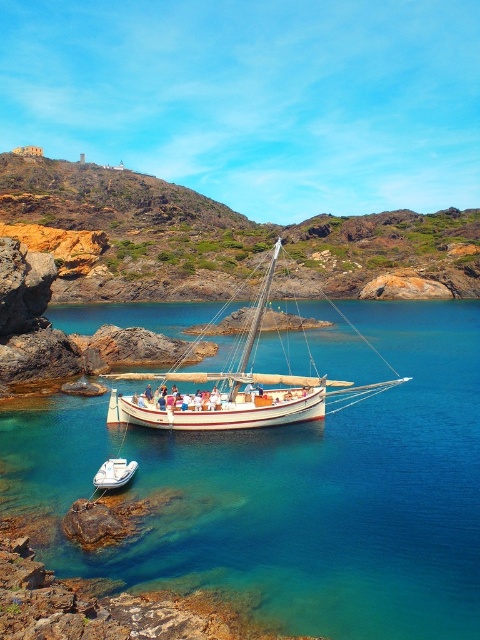
Question: Does clear blue water at center have a smaller size compared to white matte dinghy at lower left?

Choices:
 (A) yes
 (B) no

Answer: (B)

Question: Does clear blue water at center have a larger size compared to white matte dinghy at lower left?

Choices:
 (A) yes
 (B) no

Answer: (A)

Question: Among these points, which one is nearest to the camera?

Choices:
 (A) (97, 456)
 (B) (282, 392)
 (C) (415, 241)

Answer: (A)

Question: Which point is farther to the camera?

Choices:
 (A) (126, 468)
 (B) (265, 420)

Answer: (B)

Question: Is white wooden sailboat at center smaller than white matte dinghy at lower left?

Choices:
 (A) yes
 (B) no

Answer: (B)

Question: Estimate the real-world distances between objects in this image. Which object is closer to the rustic stone cliff at upper left?

Choices:
 (A) white wooden sailboat at center
 (B) white matte dinghy at lower left

Answer: (A)